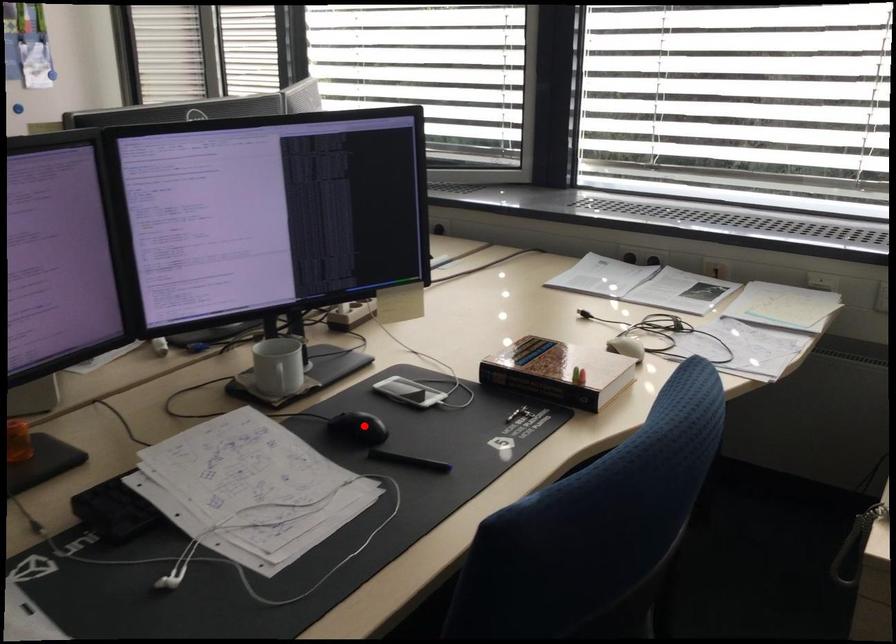
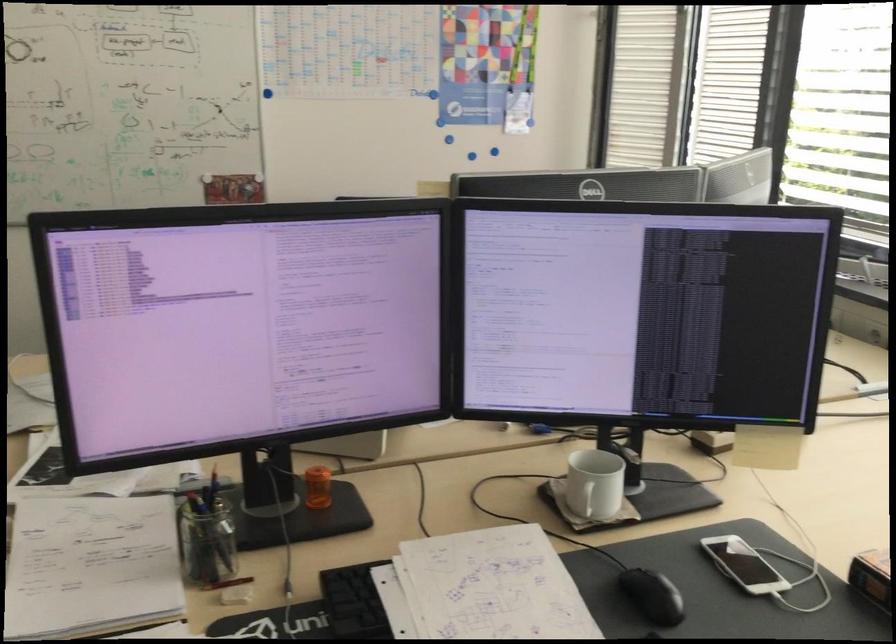
Find the pixel in the second image that matches the highlighted location in the first image.

(652, 596)